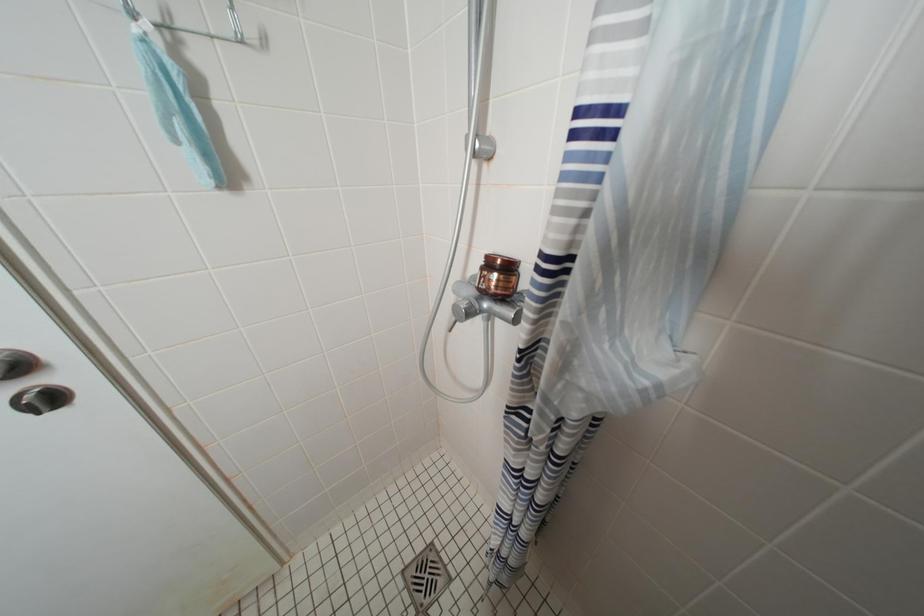
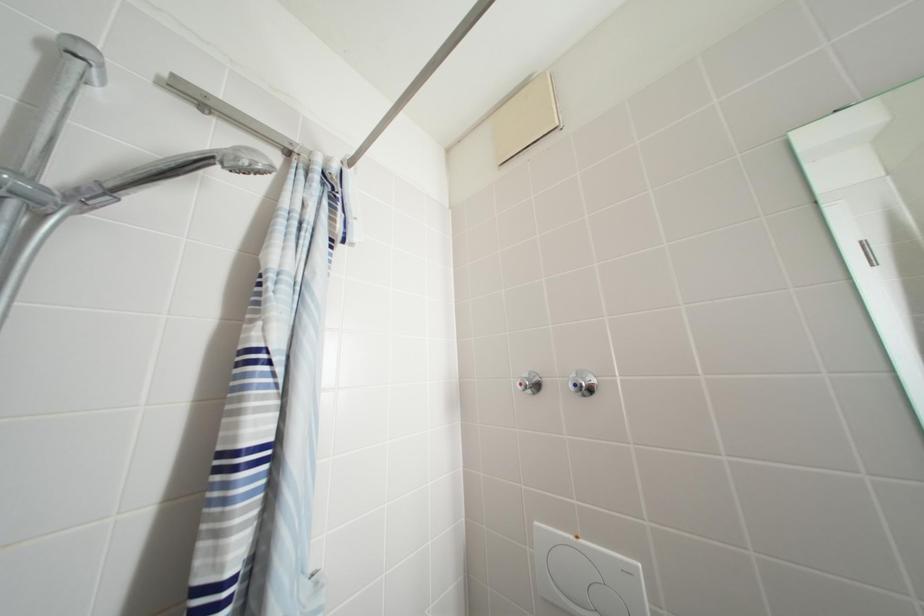
Question: The camera is either moving clockwise (left) or counter-clockwise (right) around the object. The first image is from the beginning of the video and the second image is from the end. Is the camera moving left or right when shooting the video?

Choices:
 (A) Left
 (B) Right

Answer: (A)